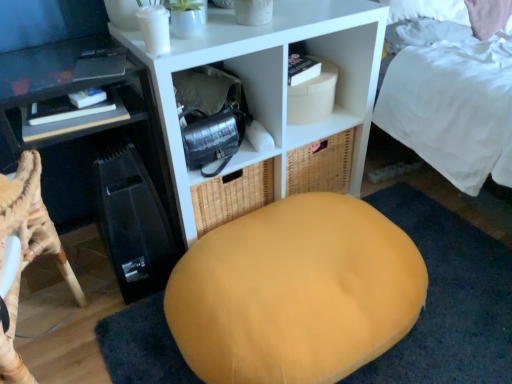
Question: From the image's perspective, is matte black desk at left located above or below white matte shelf at center, the first shelf from the right?

Choices:
 (A) above
 (B) below

Answer: (B)

Question: Is point (7, 190) positioned closer to the camera than point (248, 82)?

Choices:
 (A) farther
 (B) closer

Answer: (B)

Question: Which of these objects is positioned farthest from the black plastic shelf at left, the first shelf in the left-to-right sequence?

Choices:
 (A) white matte shelf at center, the first shelf from the right
 (B) velvet yellow bean bag at center
 (C) matte black desk at left

Answer: (B)

Question: Estimate the real-world distances between objects in this image. Which object is farther from the velvet yellow bean bag at center?

Choices:
 (A) black plastic shelf at left, marked as the 2th shelf in a right-to-left arrangement
 (B) white matte shelf at center, the first shelf from the right
 (C) matte black desk at left

Answer: (C)